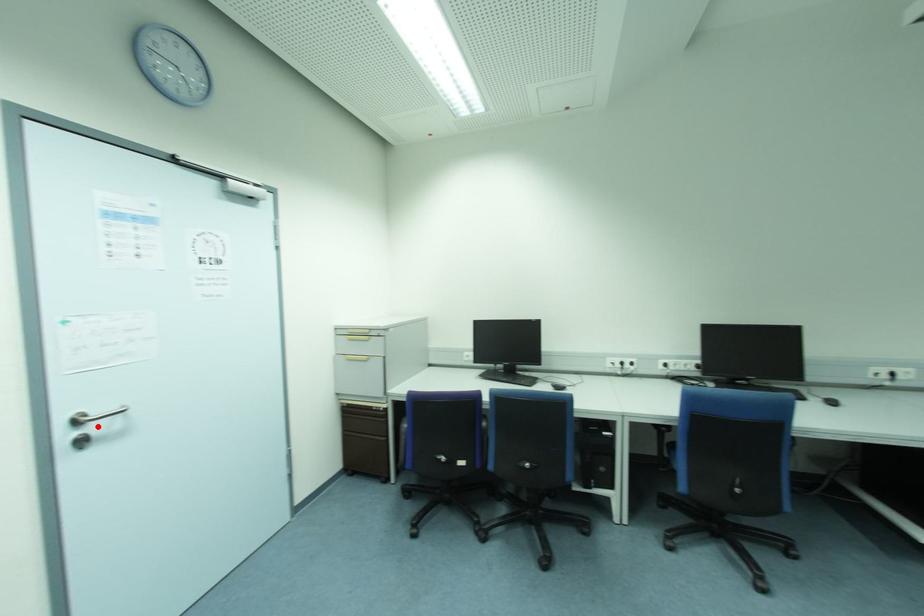
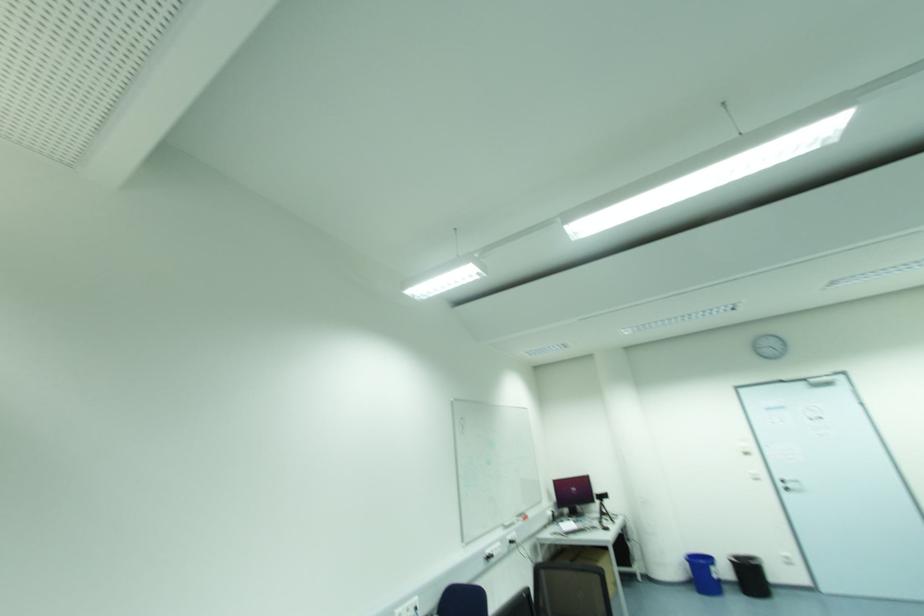
The point at the highlighted location is marked in the first image. Where is the corresponding point in the second image?

(789, 485)